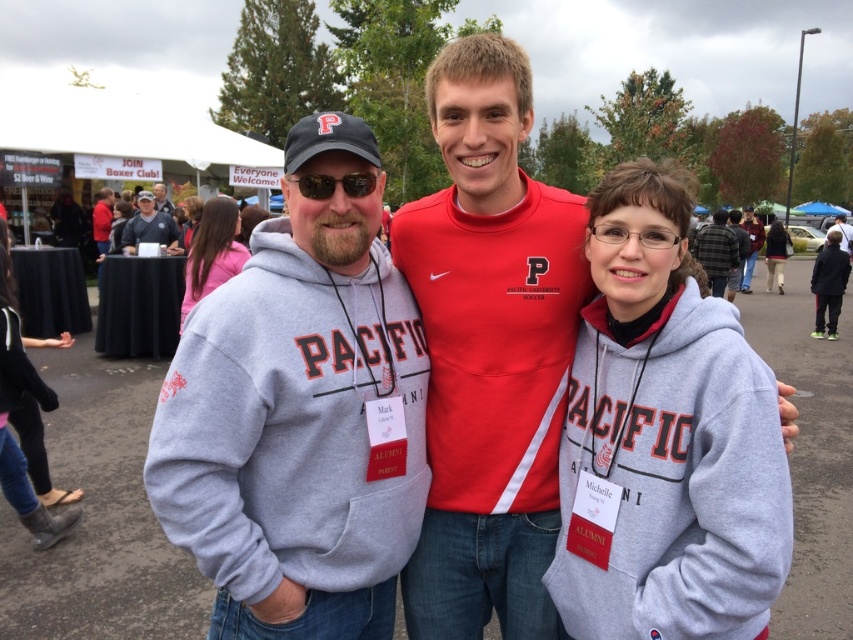
You are standing at the point marked by the coordinates point [595,380]. You want to throw a frisbee to your friend who is 1.92 meters away from you. Is the distance sufficient to make a successful throw?

Yes, the distance of 1.92 meters between you and your friend is manageable for a successful frisbee throw.

Where is the matte red hoodie at center located in the image?

The matte red hoodie at center is located at point (664, 440).